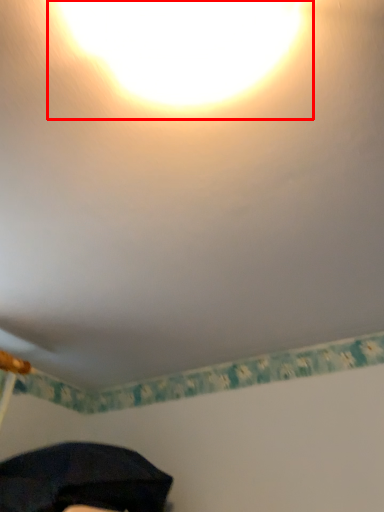
Question: Where is light (annotated by the red box) located in relation to umbrella in the image?

Choices:
 (A) right
 (B) left

Answer: (A)